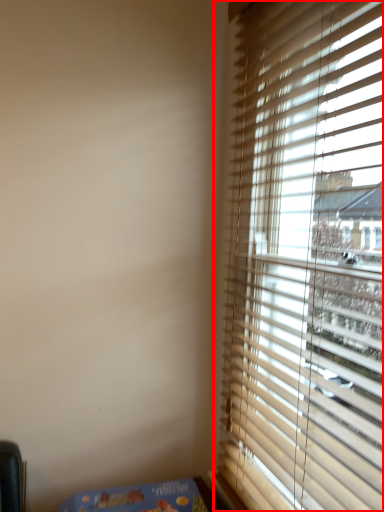
Question: From the image's perspective, what is the correct spatial relationship of window (annotated by the red box) in relation to table?

Choices:
 (A) above
 (B) below

Answer: (A)